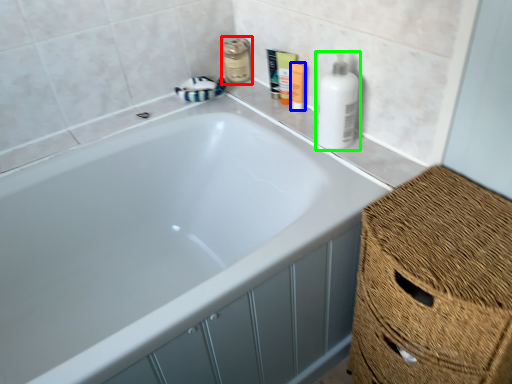
Question: Which object is the farthest from mouthwash (highlighted by a red box)? Choose among these: toiletry (highlighted by a blue box) or cleaning product (highlighted by a green box).

Choices:
 (A) toiletry
 (B) cleaning product

Answer: (B)